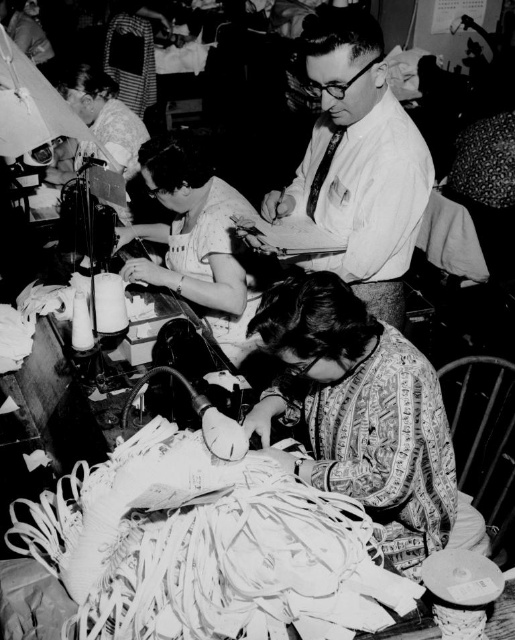
Question: Which object is positioned closest to the patterned fabric at lower center?

Choices:
 (A) matte fabric dress at center
 (B) white shirt at center

Answer: (B)

Question: Can you confirm if white shirt at center is positioned below matte fabric dress at center?

Choices:
 (A) yes
 (B) no

Answer: (B)

Question: Among these objects, which one is farthest from the camera?

Choices:
 (A) white shirt at center
 (B) patterned fabric at lower center

Answer: (A)

Question: Which point appears closest to the camera in this image?

Choices:
 (A) (359, 365)
 (B) (187, 196)

Answer: (A)

Question: Does patterned fabric at lower center come behind matte fabric dress at center?

Choices:
 (A) no
 (B) yes

Answer: (A)

Question: Does patterned fabric at lower center have a smaller size compared to white shirt at center?

Choices:
 (A) no
 (B) yes

Answer: (B)